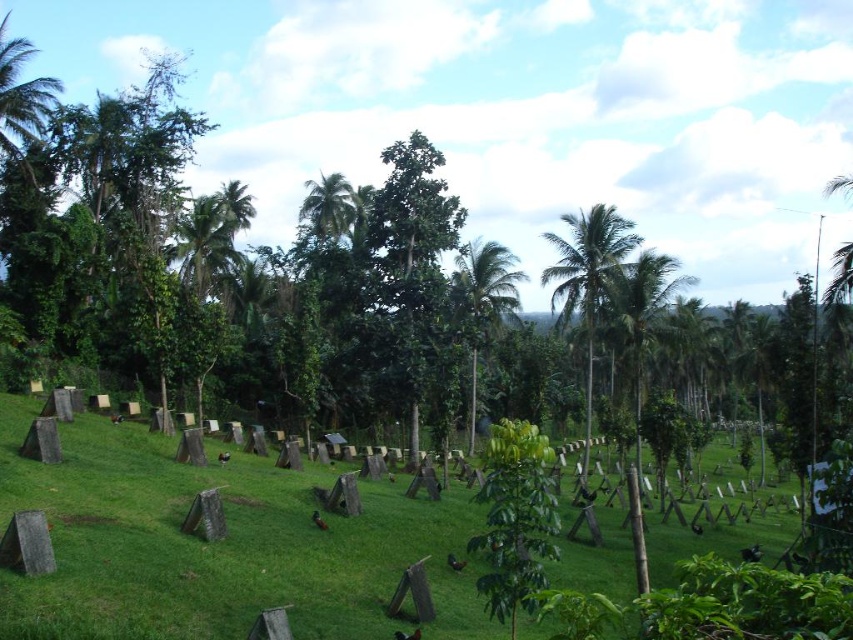
You are standing in the lush green landscape described and want to walk from the first point to the second point. Considering the arrangement of the wooden stakes and the dense tropical foliage, will you have a clear path between the point at [556,284] and the point at [508,276]?

Point [556,284] is in front of point [508,276], so the path between them is obstructed by the dense tropical foliage in the middle ground, making it unclear.